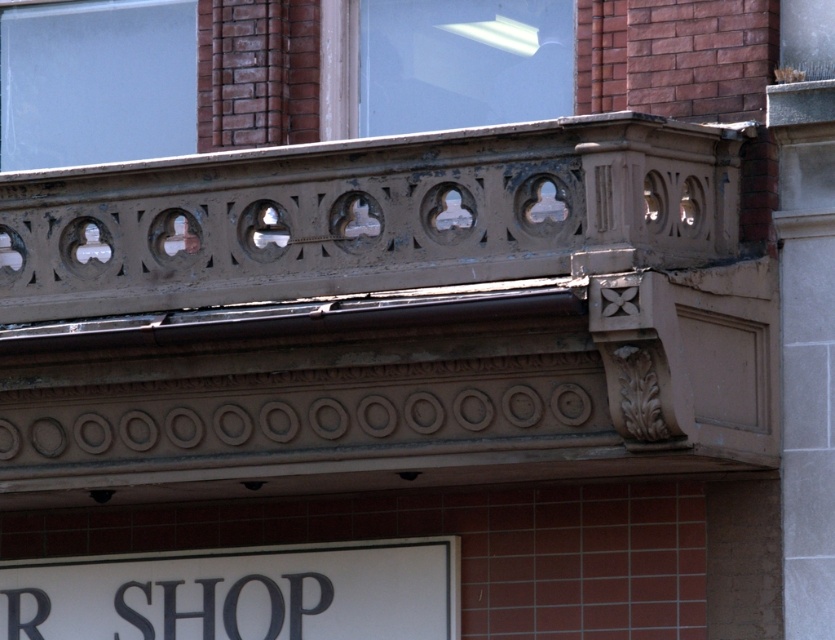
Question: Estimate the real-world distances between objects in this image. Which object is farther from the transparent glass window at upper center?

Choices:
 (A) transparent glass window at upper left
 (B) white matte sign at lower center

Answer: (B)

Question: Observing the image, what is the correct spatial positioning of matte brown balcony at upper center in reference to transparent glass window at upper center?

Choices:
 (A) right
 (B) left

Answer: (B)

Question: Is white matte sign at lower center thinner than transparent glass window at upper left?

Choices:
 (A) yes
 (B) no

Answer: (B)

Question: Among these objects, which one is nearest to the camera?

Choices:
 (A) transparent glass window at upper center
 (B) transparent glass window at upper left

Answer: (A)

Question: Can you confirm if white matte sign at lower center is positioned below transparent glass window at upper left?

Choices:
 (A) yes
 (B) no

Answer: (A)

Question: Among these points, which one is farthest from the camera?

Choices:
 (A) (327, 560)
 (B) (519, 120)
 (C) (21, 282)
 (D) (38, 148)

Answer: (D)